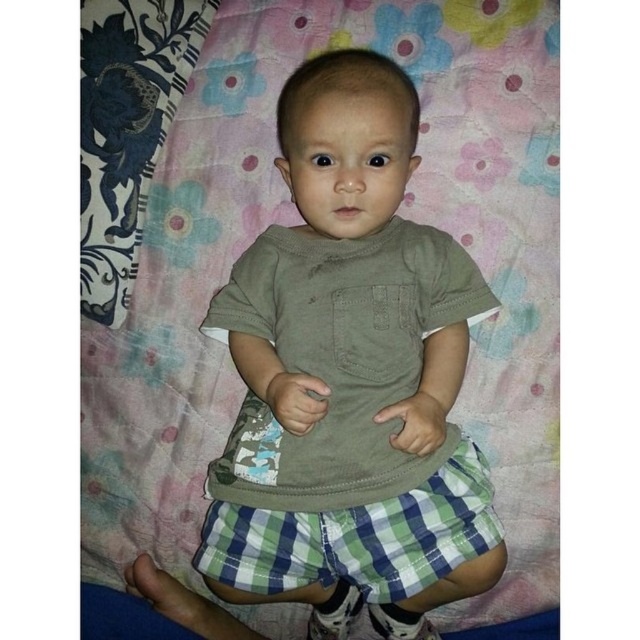
Question: Is floral fabric blanket at upper center bigger than green checkered shorts at center?

Choices:
 (A) yes
 (B) no

Answer: (A)

Question: Does floral fabric blanket at upper center appear on the left side of green checkered shorts at center?

Choices:
 (A) yes
 (B) no

Answer: (A)

Question: Which object is closer to the camera taking this photo?

Choices:
 (A) floral fabric blanket at upper center
 (B) green checkered shorts at center

Answer: (B)

Question: Which of the following is the farthest from the observer?

Choices:
 (A) floral fabric blanket at upper center
 (B) green checkered shorts at center

Answer: (A)

Question: Does floral fabric blanket at upper center appear on the right side of green checkered shorts at center?

Choices:
 (A) yes
 (B) no

Answer: (B)